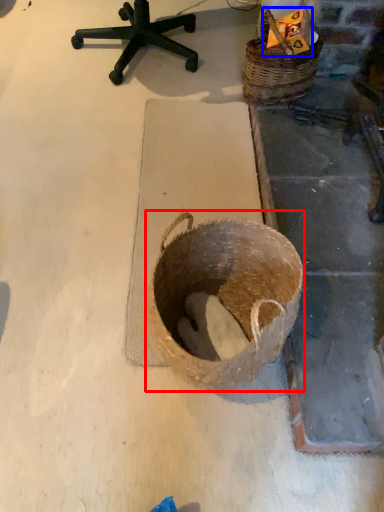
Question: Which point is further to the camera, basket (highlighted by a red box) or scrap (highlighted by a blue box)?

Choices:
 (A) basket
 (B) scrap

Answer: (B)